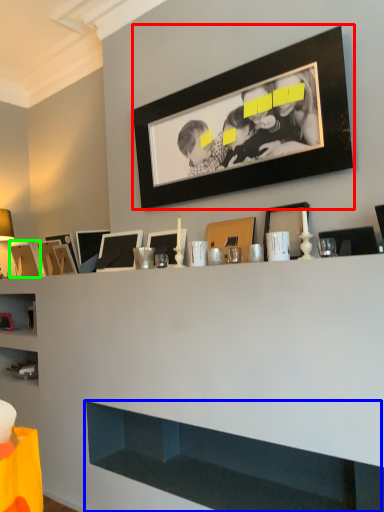
Question: Considering the real-world distances, which object is farthest from picture frame (highlighted by a red box)? cabinet (highlighted by a blue box) or picture frame (highlighted by a green box)?

Choices:
 (A) cabinet
 (B) picture frame

Answer: (B)